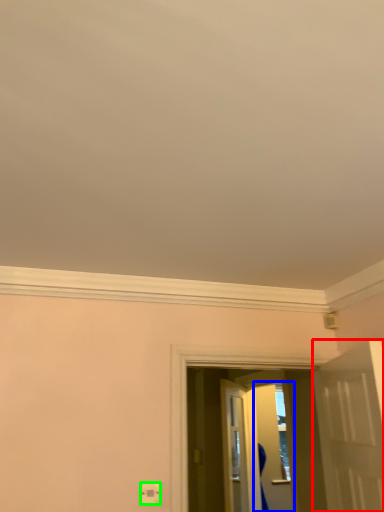
Question: Which object is positioned farthest from door (highlighted by a red box)? Select from screen door (highlighted by a blue box) and electric outlet (highlighted by a green box).

Choices:
 (A) screen door
 (B) electric outlet

Answer: (A)